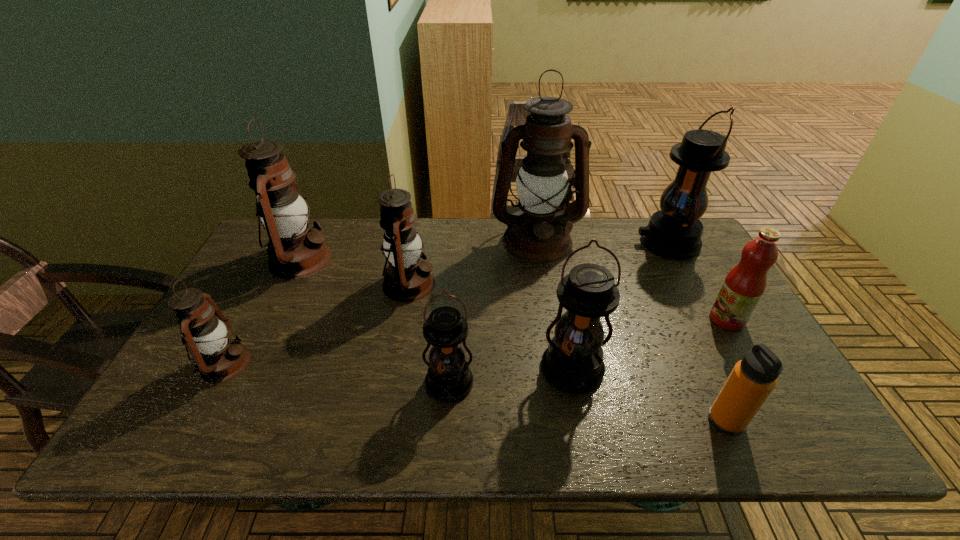
Find the location of `free space between the tallest lantern and the orange thermos bottle`. free space between the tallest lantern and the orange thermos bottle is located at coordinates click(x=632, y=330).

The image size is (960, 540). Find the location of `free space between the biggest black lantern and the tallest object`. free space between the biggest black lantern and the tallest object is located at coordinates (603, 242).

I want to click on empty space that is in between the pink fruit juice and the rightmost brown lantern, so click(632, 280).

Find the location of a particular element. The width and height of the screenshot is (960, 540). empty location between the thermos bottle and the farthest black lantern is located at coordinates (697, 332).

Identify the location of vacant area that lies between the rightmost black lantern and the second biggest brown lantern. The image size is (960, 540). (484, 251).

Image resolution: width=960 pixels, height=540 pixels. Find the location of `vacant space that's between the biggest brown lantern and the second smallest brown lantern`. vacant space that's between the biggest brown lantern and the second smallest brown lantern is located at coordinates (473, 262).

Find the location of `object that is the eighth closest to the biggest brown lantern`. object that is the eighth closest to the biggest brown lantern is located at coordinates (218, 358).

Identify which object is located as the eighth nearest to the nearest brown lantern. Please provide its 2D coordinates. Your answer should be formatted as a tuple, i.e. [(x, y)], where the tuple contains the x and y coordinates of a point satisfying the conditions above.

[(743, 287)]

I want to click on lantern that stands as the closest to the second biggest brown lantern, so click(407, 278).

Locate an element on the screen. This screenshot has width=960, height=540. lantern that is the second closest one to the leftmost black lantern is located at coordinates pos(407,278).